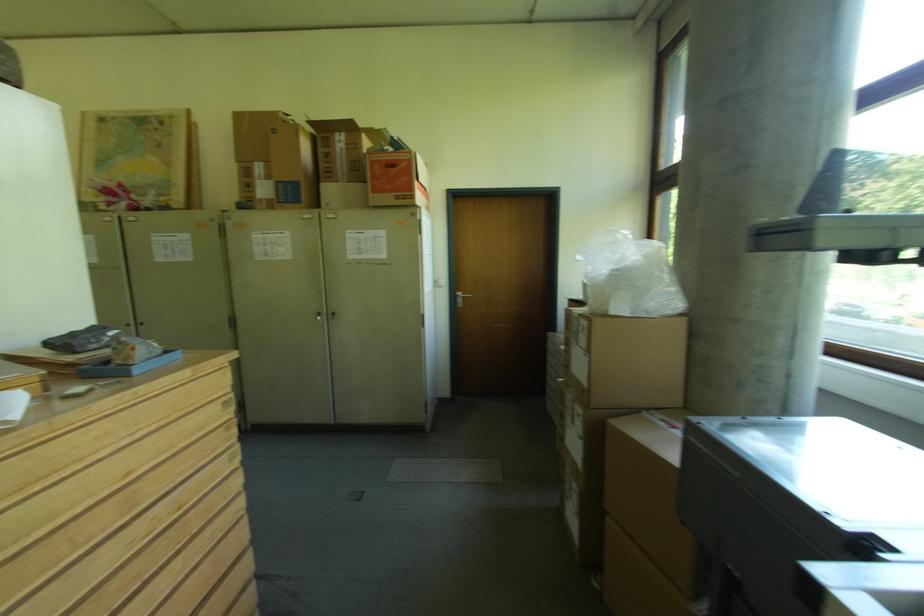
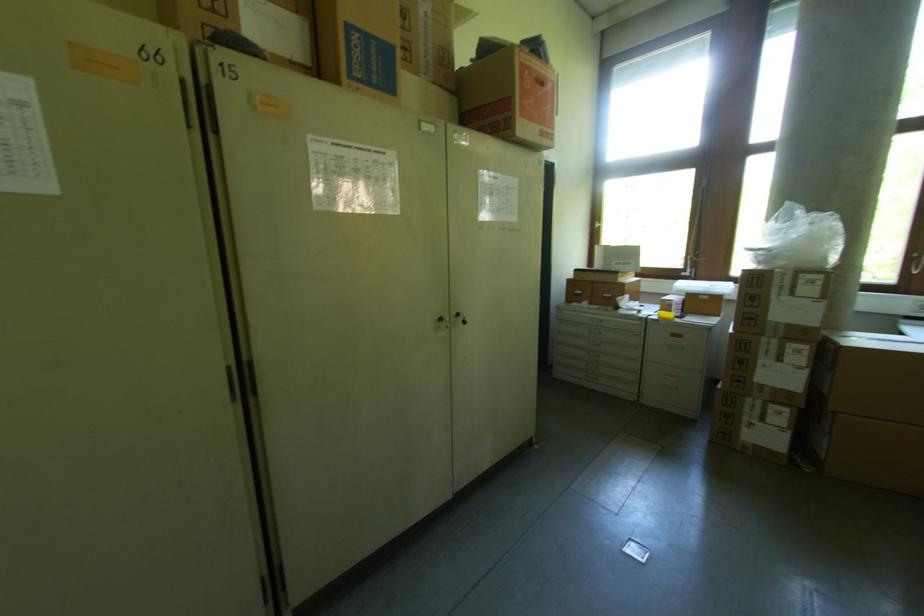
In the second image, find the point that corresponds to [333,314] in the first image.

(456, 315)